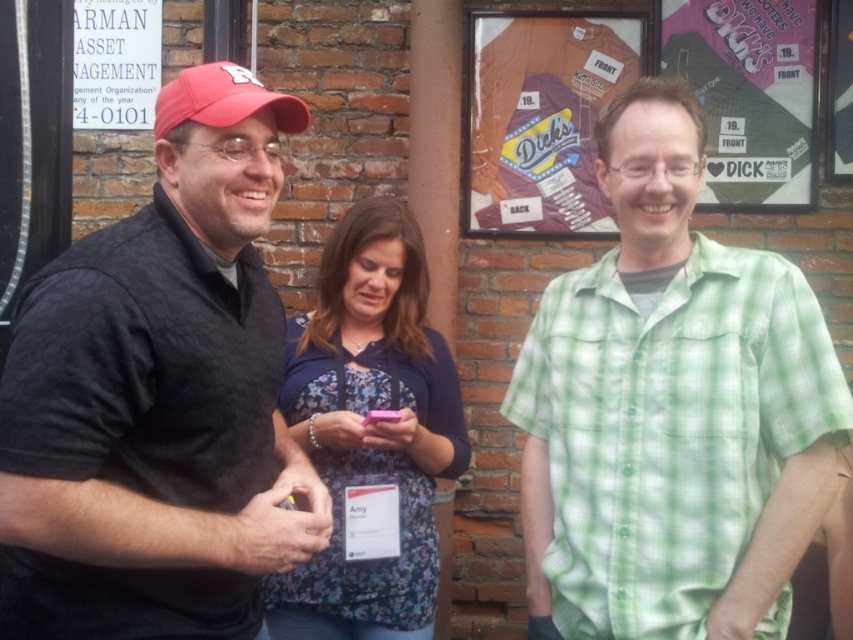
Is red matte baseball cap at upper left taller than pink plastic phone at center?

Yes.

Is red matte baseball cap at upper left wider than pink plastic phone at center?

Yes, red matte baseball cap at upper left is wider than pink plastic phone at center.

The width and height of the screenshot is (853, 640). Identify the location of red matte baseball cap at upper left. (223, 99).

At what (x,y) coordinates should I click in order to perform the action: click on red matte baseball cap at upper left. Please return your answer as a coordinate pair (x, y). The image size is (853, 640). Looking at the image, I should click on (223, 99).

Is point (206, 568) less distant than point (228, 124)?

That is True.

Which is behind, point (241, 600) or point (239, 65)?

Point (239, 65)

I want to click on black textured shirt at left, so click(160, 396).

Does black textured shirt at left have a larger size compared to floral fabric shirt at center?

Yes, black textured shirt at left is bigger than floral fabric shirt at center.

Who is more forward, (x=9, y=545) or (x=387, y=451)?

Point (x=9, y=545) is more forward.

Image resolution: width=853 pixels, height=640 pixels. In order to click on black textured shirt at left in this screenshot , I will do click(160, 396).

Where is `black textured shirt at left`? This screenshot has height=640, width=853. black textured shirt at left is located at coordinates (160, 396).